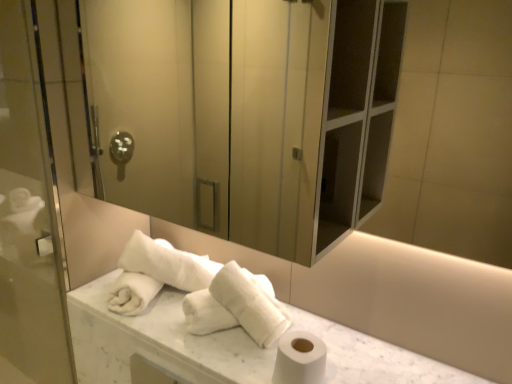
What do you see at coordinates (167, 263) in the screenshot? I see `white soft towel at center, which ranks as the 1th bath towel in left-to-right order` at bounding box center [167, 263].

I want to click on transparent glass screen door at left, which is the second screen door in right-to-left order, so click(x=29, y=213).

Find the location of a particular element. white marble counter top at center is located at coordinates (157, 341).

Does transparent glass screen door at left, acting as the first screen door starting from the left, have a greater width compared to white matte toilet paper at lower right?

No, transparent glass screen door at left, acting as the first screen door starting from the left, is not wider than white matte toilet paper at lower right.

Is transparent glass screen door at left, acting as the first screen door starting from the left, situated inside white matte toilet paper at lower right or outside?

transparent glass screen door at left, acting as the first screen door starting from the left, is not enclosed by white matte toilet paper at lower right.

Does white marble counter top at center have a smaller size compared to white soft towel at center, the second bath towel from the right?

Incorrect, white marble counter top at center is not smaller in size than white soft towel at center, the second bath towel from the right.

From the image's perspective, which one is positioned higher, white marble counter top at center or white soft towel at center, the second bath towel from the right?

white soft towel at center, the second bath towel from the right.

From a real-world perspective, which is physically below, white marble counter top at center or white soft towel at center, which ranks as the 1th bath towel in left-to-right order?

In real-world perspective, white marble counter top at center is lower.

Considering the points (251, 368) and (158, 242), which point is in front, point (251, 368) or point (158, 242)?

The point (251, 368) is closer.

Image resolution: width=512 pixels, height=384 pixels. What are the coordinates of `screen door that appears below the matte glass screen door at upper center, which ranks as the 1th screen door in right-to-left order (from the image's perspective)` in the screenshot? It's located at (29, 213).

Visually, is transparent glass screen door at left, acting as the first screen door starting from the left, positioned to the left or to the right of matte glass screen door at upper center, which ranks as the 1th screen door in right-to-left order?

transparent glass screen door at left, acting as the first screen door starting from the left, is to the left of matte glass screen door at upper center, which ranks as the 1th screen door in right-to-left order.

In the scene shown: Would you say transparent glass screen door at left, which is the second screen door in right-to-left order, contains matte glass screen door at upper center, marked as the second screen door in a left-to-right arrangement?

No.

Considering the sizes of transparent glass screen door at left, acting as the first screen door starting from the left, and matte glass screen door at upper center, marked as the second screen door in a left-to-right arrangement, in the image, is transparent glass screen door at left, acting as the first screen door starting from the left, wider or thinner than matte glass screen door at upper center, marked as the second screen door in a left-to-right arrangement,?

transparent glass screen door at left, acting as the first screen door starting from the left, is thinner than matte glass screen door at upper center, marked as the second screen door in a left-to-right arrangement.

Is white fluffy towels at center, which appears as the first bath towel when viewed from the right, aimed at white marble counter top at center?

No, white fluffy towels at center, which appears as the first bath towel when viewed from the right, is not facing towards white marble counter top at center.

From the picture: Is white fluffy towels at center, the 2th bath towel in the left-to-right sequence, thinner than white marble counter top at center?

Indeed, white fluffy towels at center, the 2th bath towel in the left-to-right sequence, has a lesser width compared to white marble counter top at center.

Is there a large distance between white fluffy towels at center, the 2th bath towel in the left-to-right sequence, and white marble counter top at center?

No, white fluffy towels at center, the 2th bath towel in the left-to-right sequence, is not far away from white marble counter top at center.

Is white fluffy towels at center, the 2th bath towel in the left-to-right sequence, at the left side of white marble counter top at center?

Correct, you'll find white fluffy towels at center, the 2th bath towel in the left-to-right sequence, to the left of white marble counter top at center.

Is white soft towel at center, the second bath towel from the right, inside or outside of transparent glass screen door at left, which is the second screen door in right-to-left order?

white soft towel at center, the second bath towel from the right, is located beyond the bounds of transparent glass screen door at left, which is the second screen door in right-to-left order.

From a real-world perspective, relative to transparent glass screen door at left, which is the second screen door in right-to-left order, is white soft towel at center, the second bath towel from the right, vertically above or below?

Clearly, from a real-world perspective, white soft towel at center, the second bath towel from the right, is below transparent glass screen door at left, which is the second screen door in right-to-left order.

Based on the photo, from the image's perspective, is white soft towel at center, the second bath towel from the right, above or below transparent glass screen door at left, acting as the first screen door starting from the left?

From the image's perspective, white soft towel at center, the second bath towel from the right, appears below transparent glass screen door at left, acting as the first screen door starting from the left.

Is white soft towel at center, which ranks as the 1th bath towel in left-to-right order, far away from transparent glass screen door at left, acting as the first screen door starting from the left?

That's not correct — white soft towel at center, which ranks as the 1th bath towel in left-to-right order, is a little close to transparent glass screen door at left, acting as the first screen door starting from the left.

Are white soft towel at center, which ranks as the 1th bath towel in left-to-right order, and white fluffy towels at center, which appears as the first bath towel when viewed from the right, far apart?

They are positioned close to each other.

Which object is closer to the camera taking this photo, white soft towel at center, which ranks as the 1th bath towel in left-to-right order, or white fluffy towels at center, the 2th bath towel in the left-to-right sequence?

white fluffy towels at center, the 2th bath towel in the left-to-right sequence, is more forward.

Could white fluffy towels at center, the 2th bath towel in the left-to-right sequence, be considered to be inside white soft towel at center, which ranks as the 1th bath towel in left-to-right order?

Actually, white fluffy towels at center, the 2th bath towel in the left-to-right sequence, is outside white soft towel at center, which ranks as the 1th bath towel in left-to-right order.

Who is smaller, white soft towel at center, which ranks as the 1th bath towel in left-to-right order, or white fluffy towels at center, the 2th bath towel in the left-to-right sequence?

With smaller size is white fluffy towels at center, the 2th bath towel in the left-to-right sequence.

Who is smaller, transparent glass screen door at left, which is the second screen door in right-to-left order, or white soft towel at center, the second bath towel from the right?

white soft towel at center, the second bath towel from the right.

From the image's perspective, is transparent glass screen door at left, which is the second screen door in right-to-left order, located above or below white soft towel at center, which ranks as the 1th bath towel in left-to-right order?

Clearly, from the image's perspective, transparent glass screen door at left, which is the second screen door in right-to-left order, is above white soft towel at center, which ranks as the 1th bath towel in left-to-right order.

Is transparent glass screen door at left, acting as the first screen door starting from the left, facing away from white soft towel at center, the second bath towel from the right?

No, white soft towel at center, the second bath towel from the right, is not at the back of transparent glass screen door at left, acting as the first screen door starting from the left.

From the image's perspective, count 1st screen doors upward from the white soft towel at center, the second bath towel from the right, and point to it. Please provide its 2D coordinates.

[(29, 213)]

This screenshot has width=512, height=384. What are the coordinates of `toilet paper on the right of transparent glass screen door at left, which is the second screen door in right-to-left order` in the screenshot? It's located at (300, 359).

Find the location of a particular element. counter top located in front of the white soft towel at center, the second bath towel from the right is located at coordinates (157, 341).

From the image, which object appears to be nearer to matte glass screen door at upper center, which ranks as the 1th screen door in right-to-left order, white fluffy towels at center, the 2th bath towel in the left-to-right sequence, or white matte toilet paper at lower right?

Based on the image, white fluffy towels at center, the 2th bath towel in the left-to-right sequence, appears to be nearer to matte glass screen door at upper center, which ranks as the 1th screen door in right-to-left order.

Which object lies further to the anchor point white fluffy towels at center, which appears as the first bath towel when viewed from the right, white soft towel at center, the second bath towel from the right, or transparent glass screen door at left, which is the second screen door in right-to-left order?

transparent glass screen door at left, which is the second screen door in right-to-left order, is positioned further to the anchor white fluffy towels at center, which appears as the first bath towel when viewed from the right.

Based on the photo, looking at the image, which one is located closer to white matte toilet paper at lower right, white fluffy towels at center, the 2th bath towel in the left-to-right sequence, or transparent glass screen door at left, acting as the first screen door starting from the left?

white fluffy towels at center, the 2th bath towel in the left-to-right sequence.

Based on their spatial positions, is white fluffy towels at center, which appears as the first bath towel when viewed from the right, or transparent glass screen door at left, acting as the first screen door starting from the left, closer to matte glass screen door at upper center, marked as the second screen door in a left-to-right arrangement?

transparent glass screen door at left, acting as the first screen door starting from the left.

Which object lies further to the anchor point white matte toilet paper at lower right, matte glass screen door at upper center, which ranks as the 1th screen door in right-to-left order, or white marble counter top at center?

matte glass screen door at upper center, which ranks as the 1th screen door in right-to-left order.

When comparing their distances from white soft towel at center, which ranks as the 1th bath towel in left-to-right order, does transparent glass screen door at left, which is the second screen door in right-to-left order, or white fluffy towels at center, the 2th bath towel in the left-to-right sequence, seem further?

transparent glass screen door at left, which is the second screen door in right-to-left order.

Looking at the image, which one is located further to white marble counter top at center, white fluffy towels at center, which appears as the first bath towel when viewed from the right, or transparent glass screen door at left, acting as the first screen door starting from the left?

transparent glass screen door at left, acting as the first screen door starting from the left.

Looking at the image, which one is located closer to transparent glass screen door at left, which is the second screen door in right-to-left order, white soft towel at center, which ranks as the 1th bath towel in left-to-right order, or white fluffy towels at center, the 2th bath towel in the left-to-right sequence?

white soft towel at center, which ranks as the 1th bath towel in left-to-right order, is closer to transparent glass screen door at left, which is the second screen door in right-to-left order.

Locate an element on the screen. bath towel between transparent glass screen door at left, which is the second screen door in right-to-left order, and matte glass screen door at upper center, which ranks as the 1th screen door in right-to-left order, from left to right is located at coordinates (167, 263).

Identify the location of bath towel situated between transparent glass screen door at left, which is the second screen door in right-to-left order, and white fluffy towels at center, the 2th bath towel in the left-to-right sequence, from left to right. (167, 263).

At what (x,y) coordinates should I click in order to perform the action: click on toilet paper positioned between white marble counter top at center and white fluffy towels at center, which appears as the first bath towel when viewed from the right, from near to far. Please return your answer as a coordinate pair (x, y). The width and height of the screenshot is (512, 384). Looking at the image, I should click on (300, 359).

Find the location of a particular element. Image resolution: width=512 pixels, height=384 pixels. screen door between transparent glass screen door at left, acting as the first screen door starting from the left, and white marble counter top at center, in the horizontal direction is located at coordinates (207, 117).